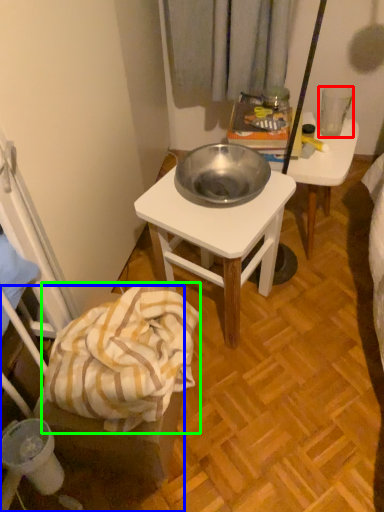
Question: Considering the real-world distances, which object is farthest from coffee cup (highlighted by a red box)? chair (highlighted by a blue box) or blanket (highlighted by a green box)?

Choices:
 (A) chair
 (B) blanket

Answer: (A)